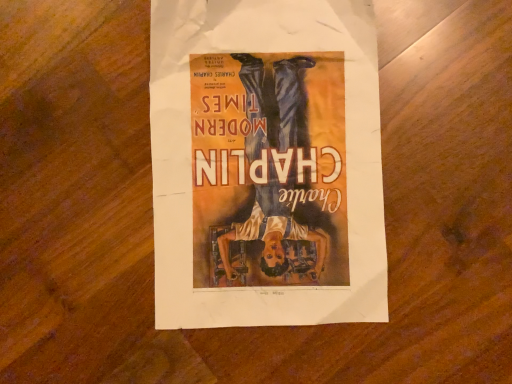
Where is `matte paper poster at center`? The height and width of the screenshot is (384, 512). matte paper poster at center is located at coordinates (266, 163).

In order to face matte paper poster at center, should I rotate leftwards or rightwards?

You should rotate right by 1.397 degrees.

Describe the element at coordinates (266, 163) in the screenshot. I see `matte paper poster at center` at that location.

Where is `matte paper poster at center`? The image size is (512, 384). matte paper poster at center is located at coordinates (266, 163).